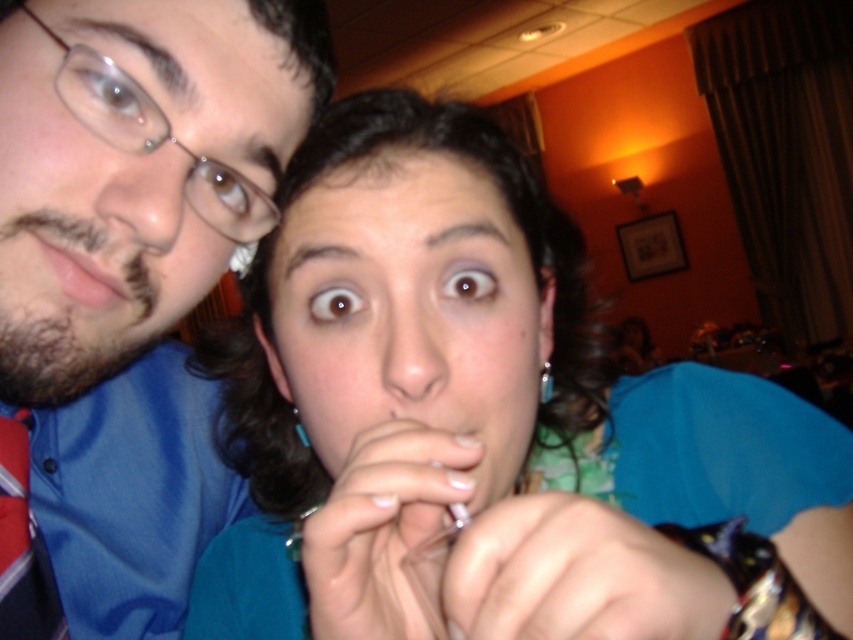
Question: Is blue fabric shirt at center bigger than matte pink lips at left?

Choices:
 (A) no
 (B) yes

Answer: (B)

Question: Considering the relative positions of blue satin shirt at upper left and matte pink lips at left in the image provided, where is blue satin shirt at upper left located with respect to matte pink lips at left?

Choices:
 (A) right
 (B) left

Answer: (B)

Question: Which point appears closest to the camera in this image?

Choices:
 (A) (56, 272)
 (B) (593, 417)

Answer: (A)

Question: Which point appears farthest from the camera in this image?

Choices:
 (A) (216, 24)
 (B) (71, 248)
 (C) (117, 118)
 (D) (366, 518)

Answer: (A)

Question: Observing the image, what is the correct spatial positioning of blue fabric shirt at center in reference to clear plastic glasses at upper left?

Choices:
 (A) right
 (B) left

Answer: (A)

Question: Which object is the farthest from the matte pink lips at left?

Choices:
 (A) blue fabric shirt at center
 (B) clear plastic glasses at upper left

Answer: (A)